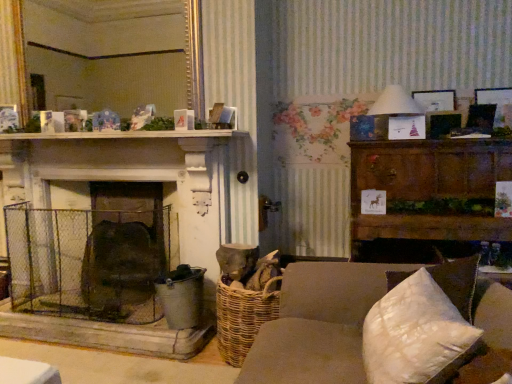
Measure the distance between wooden picture frame at upper right and camera.

They are 2.82 meters apart.

What do you see at coordinates (428, 194) in the screenshot? I see `dark brown wood cabinet at right` at bounding box center [428, 194].

Measure the distance between point [457,232] and camera.

A distance of 7.76 feet exists between point [457,232] and camera.

Find the location of a particular element. This screenshot has height=384, width=512. gold-framed mirror at upper center is located at coordinates (115, 53).

This screenshot has width=512, height=384. Find the location of `white quilted pillow at lower right`. white quilted pillow at lower right is located at coordinates (416, 334).

Where is `white paper lampshade at upper right`? white paper lampshade at upper right is located at coordinates [x=395, y=103].

From a real-world perspective, which object rests below the other?

dark brown wood cabinet at right, from a real-world perspective.

Looking at their sizes, would you say white wooden mantle at upper center is wider or thinner than dark brown wood cabinet at right?

Clearly, white wooden mantle at upper center has less width compared to dark brown wood cabinet at right.

Where is `mantle above the dark brown wood cabinet at right (from a real-world perspective)`? mantle above the dark brown wood cabinet at right (from a real-world perspective) is located at coordinates (128, 135).

Does white wooden mantle at upper center appear on the right side of dark brown wood cabinet at right?

Incorrect, white wooden mantle at upper center is not on the right side of dark brown wood cabinet at right.

Considering the points (450, 95) and (415, 186), which point is in front, point (450, 95) or point (415, 186)?

The point (415, 186) is closer.

From the image's perspective, is wooden picture frame at upper right located beneath dark brown wood cabinet at right?

Actually, wooden picture frame at upper right appears above dark brown wood cabinet at right in the image.

Is wooden picture frame at upper right positioned with its back to dark brown wood cabinet at right?

No, wooden picture frame at upper right's orientation is not away from dark brown wood cabinet at right.

From a real-world perspective, is wooden picture frame at upper right located higher than dark brown wood cabinet at right?

Yes, from a real-world perspective, wooden picture frame at upper right is over dark brown wood cabinet at right

Considering the relative sizes of brown fabric couch at center and white paper lampshade at upper right in the image provided, is brown fabric couch at center wider than white paper lampshade at upper right?

Yes, brown fabric couch at center is wider than white paper lampshade at upper right.

From the image's perspective, does brown fabric couch at center appear higher than white paper lampshade at upper right?

Incorrect, from the image's perspective, brown fabric couch at center is lower than white paper lampshade at upper right.

Which object is positioned more to the left, brown fabric couch at center or white paper lampshade at upper right?

brown fabric couch at center is more to the left.

Considering the relative sizes of rusty wire mesh fireplace screen at center-left and gold-framed mirror at upper center in the image provided, is rusty wire mesh fireplace screen at center-left shorter than gold-framed mirror at upper center?

Correct, rusty wire mesh fireplace screen at center-left is not as tall as gold-framed mirror at upper center.

Is rusty wire mesh fireplace screen at center-left inside or outside of gold-framed mirror at upper center?

The correct answer is: outside.

Considering the sizes of objects rusty wire mesh fireplace screen at center-left and gold-framed mirror at upper center in the image provided, who is smaller, rusty wire mesh fireplace screen at center-left or gold-framed mirror at upper center?

With smaller size is gold-framed mirror at upper center.

Which is closer, (138, 236) or (61, 84)?

Point (138, 236)

From the image's perspective, is gold-framed mirror at upper center above or below dark brown wood cabinet at right?

gold-framed mirror at upper center is above dark brown wood cabinet at right.

Which object is positioned more to the right, gold-framed mirror at upper center or dark brown wood cabinet at right?

dark brown wood cabinet at right.

Is point (67, 51) farther from viewer compared to point (429, 226)?

Yes, it is.

Does gold-framed mirror at upper center have a smaller size compared to dark brown wood cabinet at right?

Correct, gold-framed mirror at upper center occupies less space than dark brown wood cabinet at right.

Can you confirm if brown fabric couch at center is positioned to the right of wooden picture frame at upper right?

In fact, brown fabric couch at center is to the left of wooden picture frame at upper right.

From the image's perspective, would you say brown fabric couch at center is shown under wooden picture frame at upper right?

Yes, from the image's perspective, brown fabric couch at center is below wooden picture frame at upper right.

At what (x,y) coordinates should I click in order to perform the action: click on picture frame above the brown fabric couch at center (from the image's perspective). Please return your answer as a coordinate pair (x, y). The height and width of the screenshot is (384, 512). Looking at the image, I should click on (435, 100).

Does white paper lampshade at upper right have a greater height compared to gold-framed mirror at upper center?

No, white paper lampshade at upper right is not taller than gold-framed mirror at upper center.

Looking at this image, is white paper lampshade at upper right next to gold-framed mirror at upper center?

They are not placed beside each other.

Is point (380, 98) more distant than point (117, 88)?

No, (380, 98) is closer to viewer.

I want to click on mirror above the white paper lampshade at upper right (from a real-world perspective), so click(x=115, y=53).

Locate an element on the screen. The height and width of the screenshot is (384, 512). cabinetry directly beneath the white wooden mantle at upper center (from a real-world perspective) is located at coordinates pos(428,194).

The height and width of the screenshot is (384, 512). I want to click on cabinetry in front of the wooden picture frame at upper right, so click(428, 194).

Looking at the image, which one is located further to wooden picture frame at upper right, dark brown wood cabinet at right or white quilted pillow at lower right?

Based on the image, white quilted pillow at lower right appears to be further to wooden picture frame at upper right.

From the image, which object appears to be farther from white quilted pillow at lower right, rusty wire mesh fireplace screen at center-left or white paper lampshade at upper right?

rusty wire mesh fireplace screen at center-left is further to white quilted pillow at lower right.

Considering their positions, is dark brown wood cabinet at right positioned further to white paper lampshade at upper right than white wooden mantle at upper center?

Among the two, white wooden mantle at upper center is located further to white paper lampshade at upper right.

Considering their positions, is gold-framed mirror at upper center positioned closer to white paper lampshade at upper right than white quilted pillow at lower right?

white quilted pillow at lower right.

When comparing their distances from white wooden mantle at upper center, does dark brown wood cabinet at right or rusty wire mesh fireplace screen at center-left seem closer?

rusty wire mesh fireplace screen at center-left is positioned closer to the anchor white wooden mantle at upper center.

Based on their spatial positions, is white paper lampshade at upper right or dark brown wood cabinet at right further from gold-framed mirror at upper center?

dark brown wood cabinet at right is further to gold-framed mirror at upper center.

From the image, which object appears to be farther from gold-framed mirror at upper center, wooden picture frame at upper right or dark brown wood cabinet at right?

The object further to gold-framed mirror at upper center is wooden picture frame at upper right.

Which object lies further to the anchor point brown fabric couch at center, white wooden mantle at upper center or white quilted pillow at lower right?

white wooden mantle at upper center.

The image size is (512, 384). Find the location of `cabinetry between gold-framed mirror at upper center and wooden picture frame at upper right from left to right`. cabinetry between gold-framed mirror at upper center and wooden picture frame at upper right from left to right is located at coordinates (428, 194).

You are a GUI agent. You are given a task and a screenshot of the screen. Output one action in this format:
    pyautogui.click(x=<x>, y=<y>)
    Task: Click on the mantle between gold-framed mirror at upper center and dark brown wood cabinet at right in the horizontal direction
    This screenshot has height=384, width=512.
    Given the screenshot: What is the action you would take?
    pyautogui.click(x=128, y=135)

Locate an element on the screen. This screenshot has height=384, width=512. lamp between brown fabric couch at center and gold-framed mirror at upper center from front to back is located at coordinates (395, 103).

This screenshot has width=512, height=384. Find the location of `pillow between gold-framed mirror at upper center and dark brown wood cabinet at right in the horizontal direction`. pillow between gold-framed mirror at upper center and dark brown wood cabinet at right in the horizontal direction is located at coordinates (416, 334).